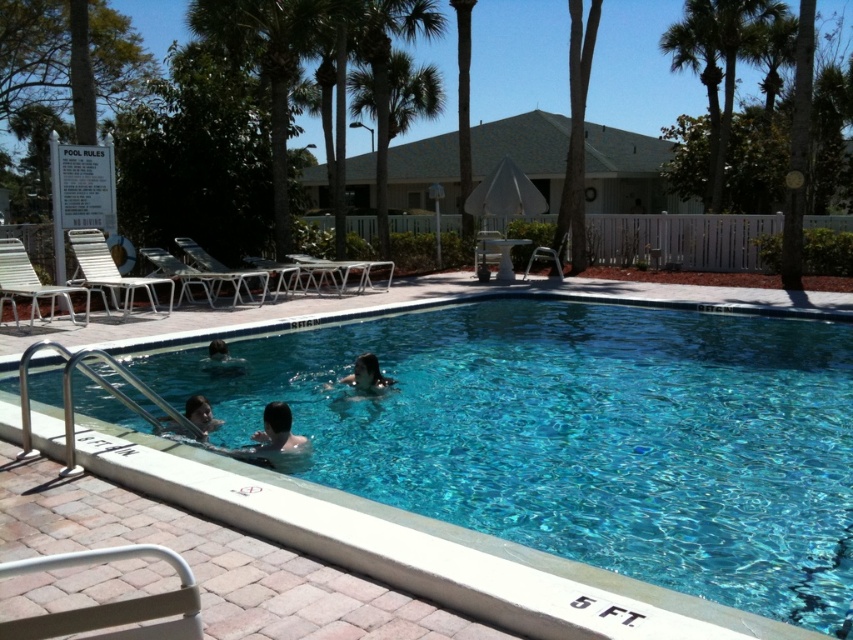
Between point (537, 355) and point (349, 106), which one is positioned in front?

Point (537, 355) is in front.

This screenshot has height=640, width=853. I want to click on clear blue water at center, so click(x=583, y=435).

Find the location of `clear blue water at center`. clear blue water at center is located at coordinates (583, 435).

Who is positioned more to the left, smooth skin person at center or smooth skin person at lower left?

smooth skin person at lower left

Which is behind, point (263, 429) or point (235, 369)?

The point (235, 369) is behind.

Find the location of a particular element. smooth skin person at center is located at coordinates (276, 429).

Does clear blue water at center have a smaller size compared to smooth skin person at center?

Incorrect, clear blue water at center is not smaller in size than smooth skin person at center.

Is clear blue water at center taller than smooth skin person at center?

Yes.

Where is `clear blue water at center`? clear blue water at center is located at coordinates (583, 435).

Image resolution: width=853 pixels, height=640 pixels. What are the coordinates of `clear blue water at center` in the screenshot? It's located at (583, 435).